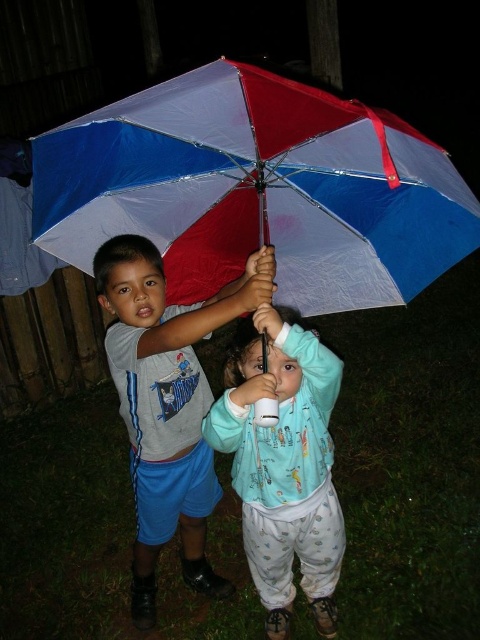
Question: Which object appears closest to the camera in this image?

Choices:
 (A) red and white plastic umbrella at center
 (B) light blue fleece jacket at center

Answer: (A)

Question: Can you confirm if red and white plastic umbrella at center is smaller than light blue fleece jacket at center?

Choices:
 (A) yes
 (B) no

Answer: (B)

Question: Is red and white plastic umbrella at center bigger than gray cotton shirt at center?

Choices:
 (A) no
 (B) yes

Answer: (B)

Question: Is red and white plastic umbrella at center bigger than gray cotton shirt at center?

Choices:
 (A) no
 (B) yes

Answer: (B)

Question: Based on their relative distances, which object is nearer to the red and white plastic umbrella at center?

Choices:
 (A) gray cotton shirt at center
 (B) light blue fleece jacket at center

Answer: (A)

Question: Which point is farther to the camera?

Choices:
 (A) 171,273
 (B) 143,561

Answer: (B)